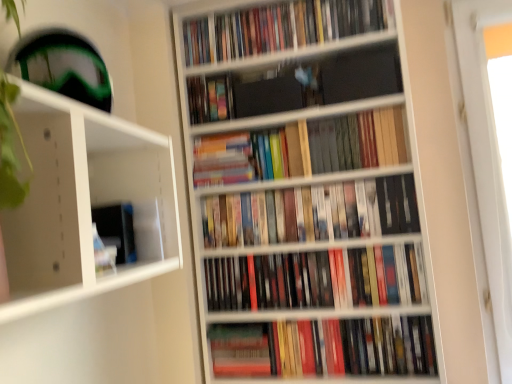
This screenshot has height=384, width=512. I want to click on hardcover books at center, which ranks as the 4th book in top-to-bottom order, so pos(247,156).

This screenshot has height=384, width=512. What do you see at coordinates (317, 279) in the screenshot? I see `hardcover books at center, marked as the 6th book in a top-to-bottom arrangement` at bounding box center [317, 279].

Locate an element on the screen. This screenshot has height=384, width=512. hardcover books at center, the 2th book positioned from the bottom is located at coordinates (317, 279).

In order to click on hardcover books at center, the 3th book ordered from the bottom in this screenshot , I will do `click(312, 213)`.

This screenshot has width=512, height=384. What do you see at coordinates (324, 347) in the screenshot?
I see `hardcover book at center, which appears as the 1th book when ordered from the bottom` at bounding box center [324, 347].

I want to click on hardcover book at center, so click(240, 350).

The width and height of the screenshot is (512, 384). What are the coordinates of `hardcover books at center, the 3th book positioned from the top` in the screenshot? It's located at (305, 148).

Does point (314, 23) appear closer or farther from the camera than point (220, 175)?

Point (314, 23).

Which of these two, hardcover books at upper center, placed as the seventh book when sorted from bottom to top, or hardcover books at center, which ranks as the 4th book in top-to-bottom order, is wider?

hardcover books at center, which ranks as the 4th book in top-to-bottom order.

This screenshot has width=512, height=384. What are the coordinates of `the 1st book in front of the hardcover books at center, which ranks as the 4th book in top-to-bottom order` in the screenshot? It's located at coord(279,28).

Is hardcover books at upper center, placed as the seventh book when sorted from bottom to top, oriented towards hardcover books at center, positioned as the fourth book in bottom-to-top order?

No.

Is point (221, 82) positioned before point (361, 123)?

No, (221, 82) is further to viewer.

Where is `book that is the 2nd object above the hardcover books at center, marked as the fifth book in a bottom-to-top arrangement (from a real-world perspective)`? The width and height of the screenshot is (512, 384). book that is the 2nd object above the hardcover books at center, marked as the fifth book in a bottom-to-top arrangement (from a real-world perspective) is located at coordinates (210, 99).

In the scene shown: Does multicolored hardcover books at center, the second book when ordered from top to bottom, have a larger size compared to hardcover books at center, the 3th book positioned from the top?

No, multicolored hardcover books at center, the second book when ordered from top to bottom, is not bigger than hardcover books at center, the 3th book positioned from the top.

Does hardcover book at center, which is the seventh book in top-to-bottom order, turn towards hardcover books at center, the fifth book when ordered from top to bottom?

No, hardcover book at center, which is the seventh book in top-to-bottom order, is not facing towards hardcover books at center, the fifth book when ordered from top to bottom.

Would you say hardcover book at center, which is the seventh book in top-to-bottom order, is inside or outside hardcover books at center, the 3th book ordered from the bottom?

hardcover book at center, which is the seventh book in top-to-bottom order, is spatially situated outside hardcover books at center, the 3th book ordered from the bottom.

Considering the positions of points (278, 344) and (264, 218), is point (278, 344) farther from camera compared to point (264, 218)?

No, it is in front of (264, 218).

Which is more to the left, hardcover book at center, which is the seventh book in top-to-bottom order, or hardcover books at center, the 3th book ordered from the bottom?

hardcover books at center, the 3th book ordered from the bottom.

Which object is closer to the camera, multicolored hardcover books at center, arranged as the 6th book when ordered from the bottom, or hardcover books at center, the 3th book ordered from the bottom?

hardcover books at center, the 3th book ordered from the bottom.

Can you confirm if multicolored hardcover books at center, arranged as the 6th book when ordered from the bottom, is wider than hardcover books at center, the fifth book when ordered from top to bottom?

Indeed, multicolored hardcover books at center, arranged as the 6th book when ordered from the bottom, has a greater width compared to hardcover books at center, the fifth book when ordered from top to bottom.

Can you tell me how much multicolored hardcover books at center, the second book when ordered from top to bottom, and hardcover books at center, the 3th book ordered from the bottom, differ in facing direction?

0.817 degrees separate the facing orientations of multicolored hardcover books at center, the second book when ordered from top to bottom, and hardcover books at center, the 3th book ordered from the bottom.

Is multicolored hardcover books at center, arranged as the 6th book when ordered from the bottom, situated inside hardcover books at center, the fifth book when ordered from top to bottom, or outside?

The correct answer is: outside.

In the scene shown: Can you tell me how much wooden bookshelf at center and hardcover book at center differ in facing direction?

wooden bookshelf at center and hardcover book at center are facing 2.44 degrees away from each other.

The width and height of the screenshot is (512, 384). What are the coordinates of `bookcase that appears in front of the hardcover book at center` in the screenshot? It's located at (308, 196).

Is hardcover book at center located within wooden bookshelf at center?

Absolutely, hardcover book at center is inside wooden bookshelf at center.

Can you confirm if wooden bookshelf at center is positioned to the right of hardcover book at center?

Yes.

Is hardcover book at center, which is the seventh book in top-to-bottom order, far from wooden bookshelf at center?

That's not correct — hardcover book at center, which is the seventh book in top-to-bottom order, is a little close to wooden bookshelf at center.

Between hardcover book at center, which appears as the 1th book when ordered from the bottom, and wooden bookshelf at center, which one has more height?

wooden bookshelf at center is taller.

Is point (322, 355) closer to camera compared to point (355, 89)?

No, it is not.

From a real-world perspective, is hardcover book at center over hardcover books at center, the 2th book positioned from the bottom?

Incorrect, from a real-world perspective, hardcover book at center is lower than hardcover books at center, the 2th book positioned from the bottom.

Choose the correct answer: Is hardcover book at center inside hardcover books at center, marked as the 6th book in a top-to-bottom arrangement, or outside it?

hardcover book at center exists outside the volume of hardcover books at center, marked as the 6th book in a top-to-bottom arrangement.

Are hardcover book at center and hardcover books at center, the 2th book positioned from the bottom, located far from each other?

No, there isn't a large distance between hardcover book at center and hardcover books at center, the 2th book positioned from the bottom.

From the picture: In the image, is hardcover book at center on the left side or the right side of hardcover books at center, marked as the 6th book in a top-to-bottom arrangement?

hardcover book at center is positioned on hardcover books at center, marked as the 6th book in a top-to-bottom arrangement,'s left side.

The width and height of the screenshot is (512, 384). In order to click on the 2nd book above the hardcover books at center, which ranks as the 4th book in top-to-bottom order (from a real-world perspective) in this screenshot , I will do (279, 28).

From the image's perspective, which book is the 1st one above the hardcover books at center, the 3th book positioned from the top? Please provide its 2D coordinates.

[(210, 99)]

Which object lies nearer to the anchor point hardcover books at center, the 3th book ordered from the bottom, wooden bookshelf at center or hardcover books at center, the 3th book positioned from the top?

Among the two, hardcover books at center, the 3th book positioned from the top, is located nearer to hardcover books at center, the 3th book ordered from the bottom.

Considering their positions, is hardcover book at center, which appears as the 1th book when ordered from the bottom, positioned closer to hardcover books at center, marked as the fifth book in a bottom-to-top arrangement, than multicolored hardcover books at center, the second book when ordered from top to bottom?

multicolored hardcover books at center, the second book when ordered from top to bottom, is closer to hardcover books at center, marked as the fifth book in a bottom-to-top arrangement.

Looking at the image, which one is located closer to multicolored hardcover books at center, the second book when ordered from top to bottom, wooden bookshelf at center or hardcover books at upper center, positioned as the first book in top-to-bottom order?

hardcover books at upper center, positioned as the first book in top-to-bottom order, is positioned closer to the anchor multicolored hardcover books at center, the second book when ordered from top to bottom.

Which object lies further to the anchor point hardcover books at upper center, positioned as the first book in top-to-bottom order, hardcover books at center, the fifth book when ordered from top to bottom, or hardcover books at center, which ranks as the 4th book in top-to-bottom order?

hardcover books at center, the fifth book when ordered from top to bottom, is further to hardcover books at upper center, positioned as the first book in top-to-bottom order.

From the image, which object appears to be farther from hardcover book at center, wooden bookshelf at center or hardcover books at center, marked as the fifth book in a bottom-to-top arrangement?

hardcover books at center, marked as the fifth book in a bottom-to-top arrangement, lies further to hardcover book at center than the other object.

When comparing their distances from hardcover books at center, which ranks as the 4th book in top-to-bottom order, does hardcover books at center, marked as the 6th book in a top-to-bottom arrangement, or multicolored hardcover books at center, arranged as the 6th book when ordered from the bottom, seem closer?

Based on the image, multicolored hardcover books at center, arranged as the 6th book when ordered from the bottom, appears to be nearer to hardcover books at center, which ranks as the 4th book in top-to-bottom order.

Based on their spatial positions, is hardcover books at center, the 3th book ordered from the bottom, or hardcover books at center, the 3th book positioned from the top, closer to hardcover book at center?

Result: Based on the image, hardcover books at center, the 3th book ordered from the bottom, appears to be nearer to hardcover book at center.

Looking at this image, when comparing their distances from wooden bookshelf at center, does hardcover books at center, marked as the fifth book in a bottom-to-top arrangement, or multicolored hardcover books at center, the second book when ordered from top to bottom, seem closer?

The object closer to wooden bookshelf at center is hardcover books at center, marked as the fifth book in a bottom-to-top arrangement.

In order to click on bookcase between hardcover books at center, positioned as the fourth book in bottom-to-top order, and hardcover book at center vertically in this screenshot , I will do (x=308, y=196).

You are a GUI agent. You are given a task and a screenshot of the screen. Output one action in this format:
    pyautogui.click(x=<x>, y=<y>)
    Task: Click on the bookcase that lies between multicolored hardcover books at center, arranged as the 6th book when ordered from the bottom, and hardcover book at center, which is the seventh book in top-to-bottom order, from top to bottom
    Image resolution: width=512 pixels, height=384 pixels.
    Given the screenshot: What is the action you would take?
    pyautogui.click(x=308, y=196)

Where is `book between hardcover books at center, the 3th book ordered from the bottom, and hardcover book at center, which is the seventh book in top-to-bottom order, from top to bottom`? book between hardcover books at center, the 3th book ordered from the bottom, and hardcover book at center, which is the seventh book in top-to-bottom order, from top to bottom is located at coordinates (317, 279).

This screenshot has width=512, height=384. What are the coordinates of `bookcase between multicolored hardcover books at center, arranged as the 6th book when ordered from the bottom, and hardcover books at center, the 3th book ordered from the bottom, in the up-down direction` in the screenshot? It's located at (308, 196).